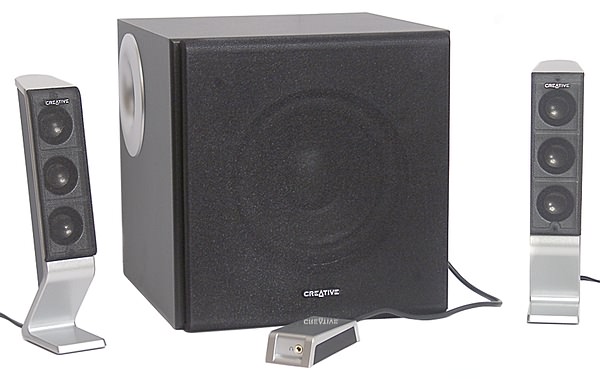
This screenshot has width=600, height=379. In order to click on 3 circles on left speaker in this screenshot , I will do `click(57, 130)`, `click(68, 180)`, `click(70, 232)`.